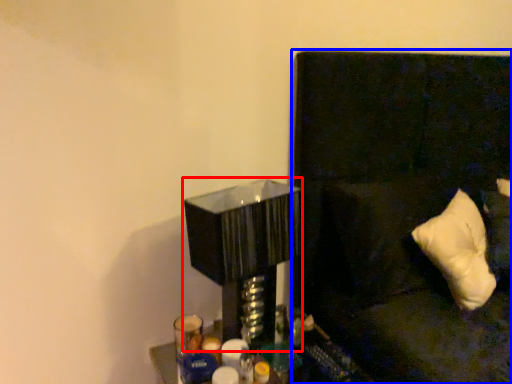
Question: Which object is closer to the camera taking this photo, table lamp (highlighted by a red box) or couch (highlighted by a blue box)?

Choices:
 (A) table lamp
 (B) couch

Answer: (A)